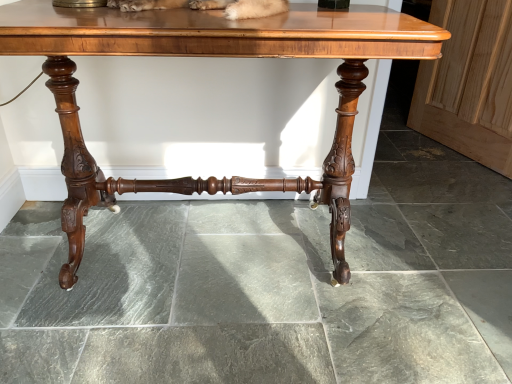
Question: From the image's perspective, does wooden screen door at right appear higher than polished wood table at center?

Choices:
 (A) no
 (B) yes

Answer: (B)

Question: Is wooden screen door at right touching polished wood table at center?

Choices:
 (A) no
 (B) yes

Answer: (A)

Question: Considering the relative positions of wooden screen door at right and polished wood table at center in the image provided, is wooden screen door at right to the left of polished wood table at center from the viewer's perspective?

Choices:
 (A) no
 (B) yes

Answer: (A)

Question: Does wooden screen door at right have a greater width compared to polished wood table at center?

Choices:
 (A) yes
 (B) no

Answer: (B)

Question: Could you tell me if wooden screen door at right is turned towards polished wood table at center?

Choices:
 (A) yes
 (B) no

Answer: (A)

Question: Is wooden screen door at right shorter than polished wood table at center?

Choices:
 (A) yes
 (B) no

Answer: (A)

Question: Considering the relative sizes of polished wood table at center and wooden screen door at right in the image provided, is polished wood table at center thinner than wooden screen door at right?

Choices:
 (A) yes
 (B) no

Answer: (B)

Question: Is polished wood table at center wider than wooden screen door at right?

Choices:
 (A) yes
 (B) no

Answer: (A)

Question: Are polished wood table at center and wooden screen door at right making contact?

Choices:
 (A) yes
 (B) no

Answer: (B)

Question: From the image's perspective, is polished wood table at center below wooden screen door at right?

Choices:
 (A) yes
 (B) no

Answer: (A)

Question: Can you confirm if polished wood table at center is bigger than wooden screen door at right?

Choices:
 (A) no
 (B) yes

Answer: (B)

Question: From a real-world perspective, is polished wood table at center below wooden screen door at right?

Choices:
 (A) yes
 (B) no

Answer: (B)

Question: From a real-world perspective, is wooden screen door at right above or below polished wood table at center?

Choices:
 (A) below
 (B) above

Answer: (A)